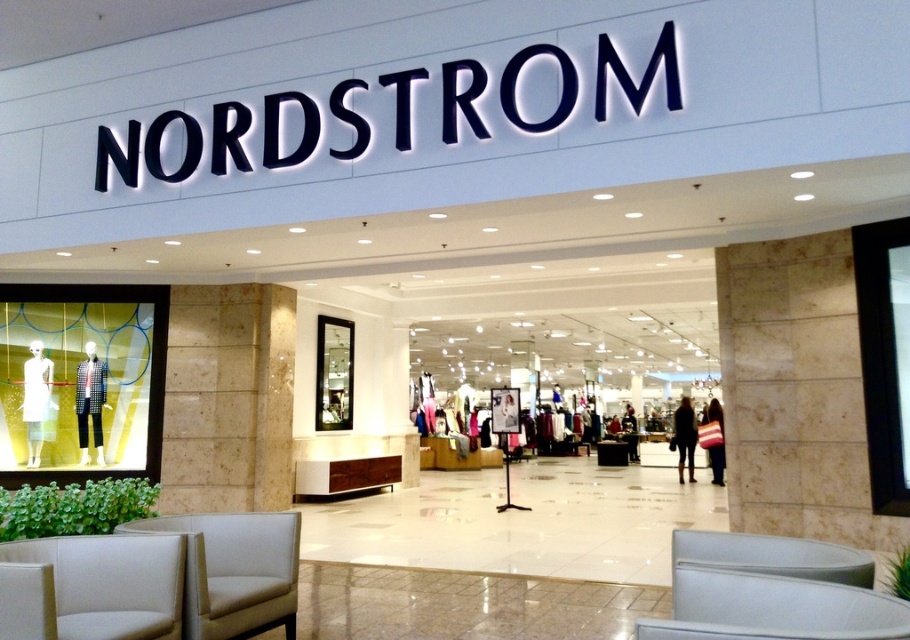
Who is positioned more to the left, white fabric armchair at lower left or dark brown leather jacket at center?

Positioned to the left is white fabric armchair at lower left.

Who is more forward, (37, 628) or (684, 396)?

Point (37, 628)

Does point (140, 582) lie in front of point (688, 452)?

Yes, point (140, 582) is in front of point (688, 452).

Where is `white fabric armchair at lower left`? white fabric armchair at lower left is located at coordinates (91, 588).

Between point (251, 538) and point (684, 429), which one is positioned in front?

Point (251, 538)

The height and width of the screenshot is (640, 910). What do you see at coordinates (234, 570) in the screenshot? I see `white leather armchair at lower left` at bounding box center [234, 570].

Is point (221, 516) farther from viewer compared to point (678, 408)?

No, (221, 516) is in front of (678, 408).

Locate an element on the screen. The height and width of the screenshot is (640, 910). white leather armchair at lower left is located at coordinates [234, 570].

Is point (4, 596) positioned after point (201, 538)?

No.

Who is more distant from viewer, (47, 625) or (217, 589)?

Point (217, 589)

Does point (122, 595) come behind point (248, 600)?

That is False.

You are a GUI agent. You are given a task and a screenshot of the screen. Output one action in this format:
    pyautogui.click(x=<x>, y=<y>)
    Task: Click on the white fabric armchair at lower left
    
    Given the screenshot: What is the action you would take?
    pyautogui.click(x=91, y=588)